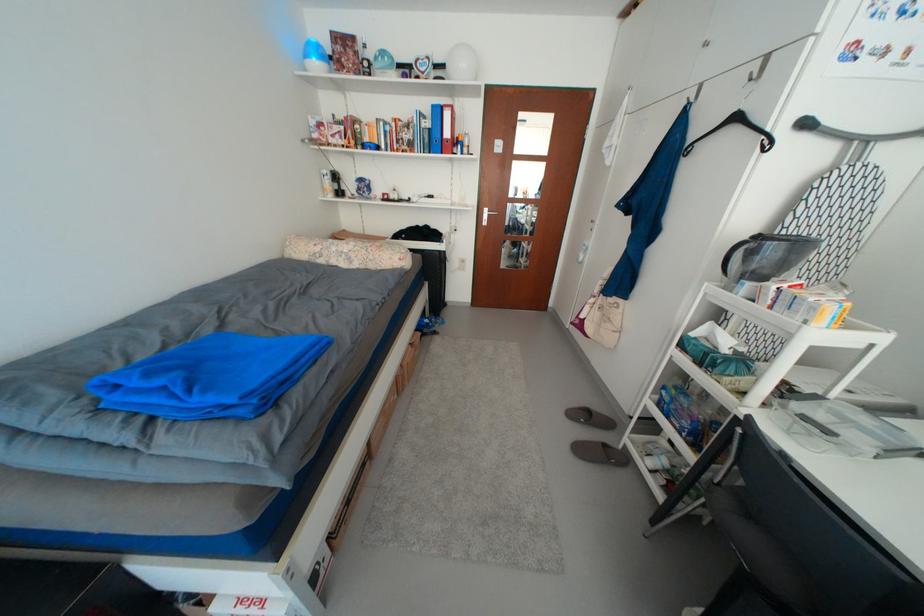
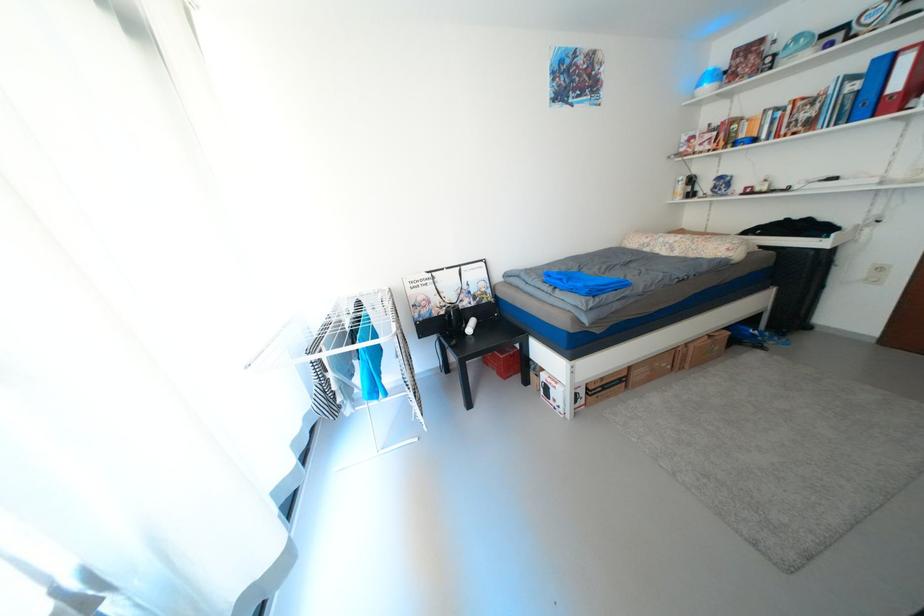
Where in the second image is the point corresponding to point 124,400 from the first image?

(556, 281)